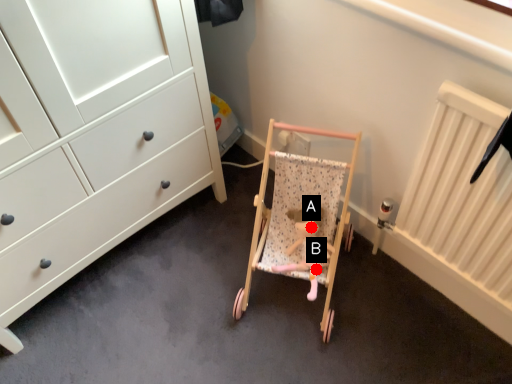
Question: Two points are circled on the image, labeled by A and B beside each circle. Which point appears farthest from the camera in this image?

Choices:
 (A) A is further
 (B) B is further

Answer: (B)